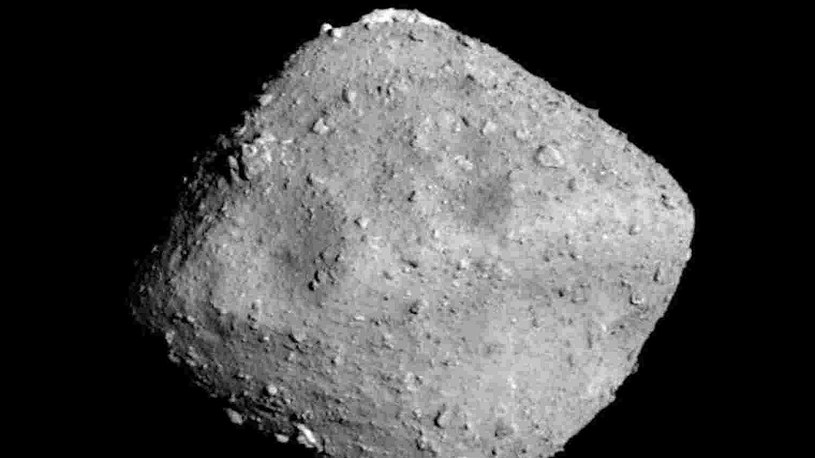
Find the location of a particular element. This screenshot has width=815, height=458. table is located at coordinates (86, 196).